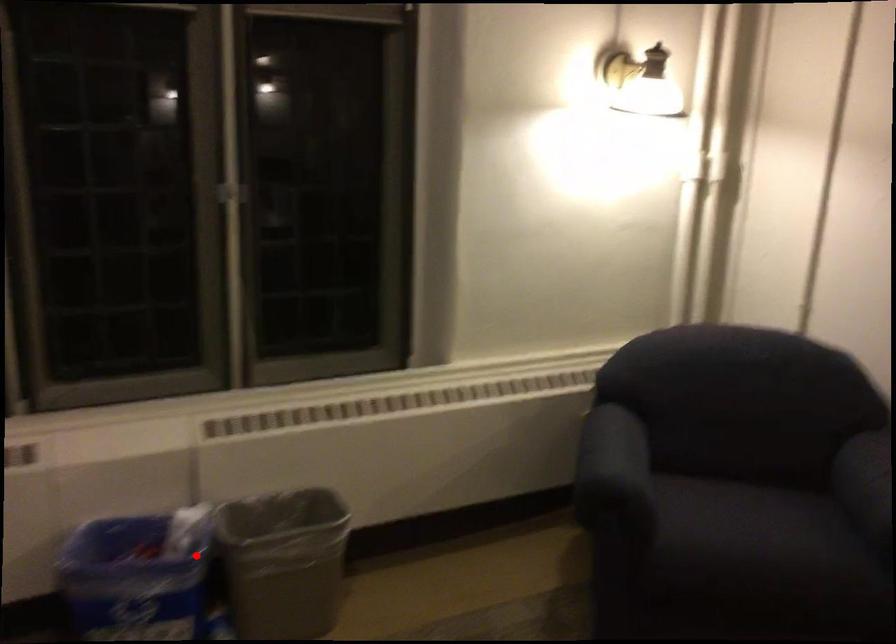
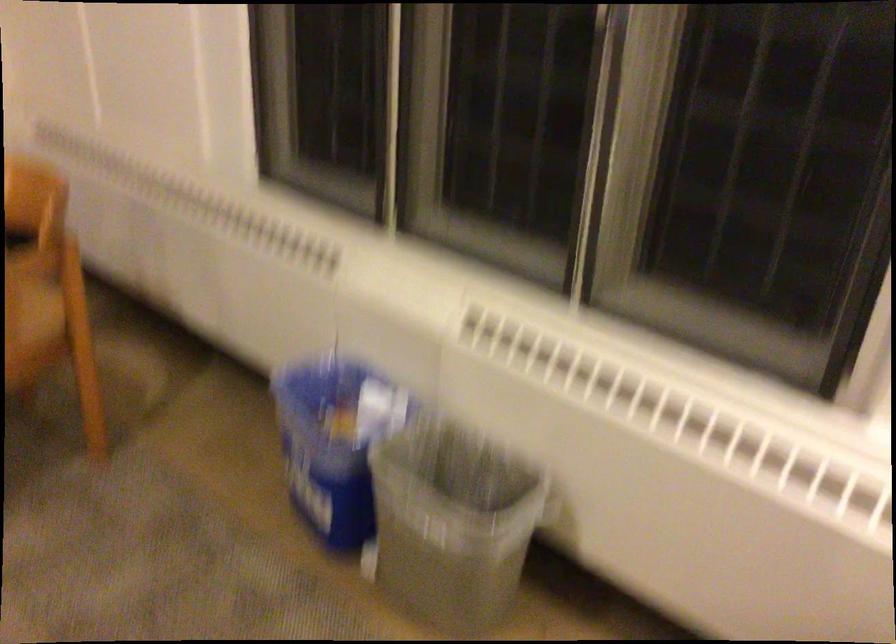
Question: I am providing you with two images of the same scene from different viewpoints. A red point is shown in image1. For the corresponding object point in image2, is it positioned nearer or farther from the camera?

Choices:
 (A) Nearer
 (B) Farther

Answer: (A)